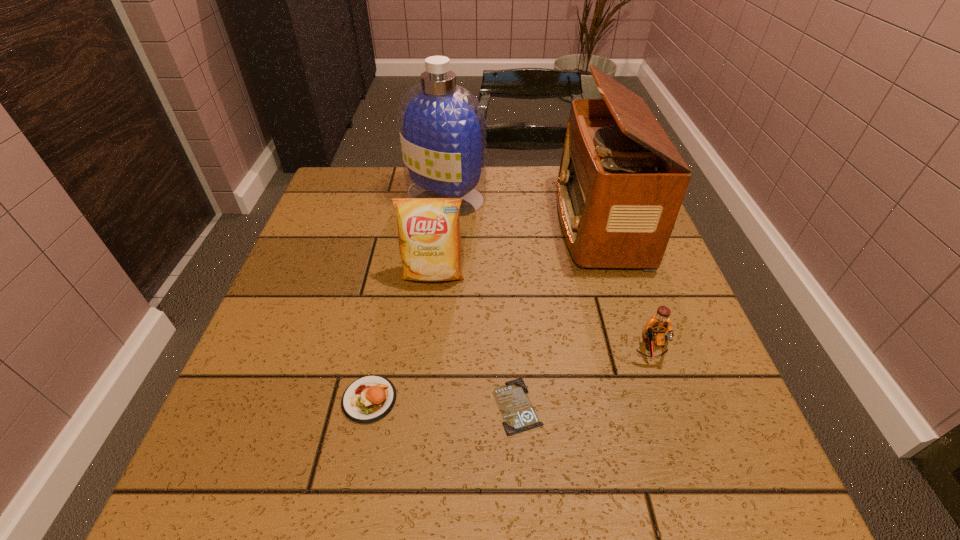
The image size is (960, 540). In order to click on free space located 0.300m on the front panel of the radio receiver in this screenshot , I will do `click(441, 222)`.

The image size is (960, 540). What are the coordinates of `free space located on the front panel of the radio receiver` in the screenshot? It's located at (540, 222).

Image resolution: width=960 pixels, height=540 pixels. Find the location of `vacant space located on the front-facing side of the third tallest object`. vacant space located on the front-facing side of the third tallest object is located at coordinates (411, 479).

This screenshot has width=960, height=540. I want to click on vacant position located holding a crossbow in the hands of the third shortest object, so click(x=708, y=512).

You are a GUI agent. You are given a task and a screenshot of the screen. Output one action in this format:
    pyautogui.click(x=<x>, y=<y>)
    Task: Click on the free point located 0.130m on the front of the fifth tallest object
    
    Given the screenshot: What is the action you would take?
    pyautogui.click(x=348, y=509)

You are a GUI agent. You are given a task and a screenshot of the screen. Output one action in this format:
    pyautogui.click(x=<x>, y=<y>)
    Task: Click on the free space located 0.050m on the back of the fourth object from left to right
    This screenshot has width=960, height=540.
    Given the screenshot: What is the action you would take?
    pyautogui.click(x=514, y=355)

Identify the location of cleansing agent present at the far edge. The height and width of the screenshot is (540, 960). (442, 127).

Locate an element on the screen. Image resolution: width=960 pixels, height=540 pixels. radio receiver that is positioned at the far edge is located at coordinates (618, 196).

Where is `radio receiver located at the right edge`? Image resolution: width=960 pixels, height=540 pixels. radio receiver located at the right edge is located at coordinates (618, 196).

Locate an element on the screen. The height and width of the screenshot is (540, 960). Lego that is positioned at the right edge is located at coordinates (656, 327).